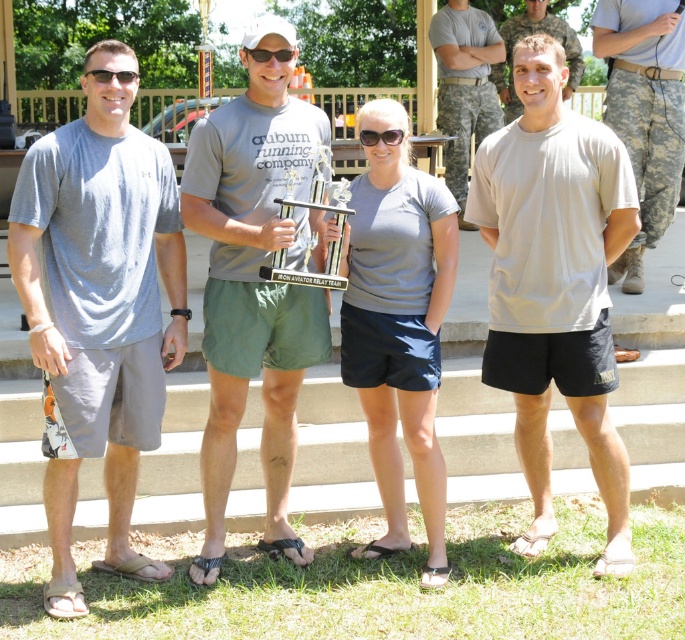
You are a photographer trying to capture a clear photo of the transparent plastic goggles at center. However, the matte black sunglasses at upper left are partially blocking your view. Can you move the sunglasses to get a better shot?

The matte black sunglasses at upper left is behind the transparent plastic goggles at center, so moving the sunglasses would not help as they are already positioned behind the goggles. You might need to adjust your angle instead.